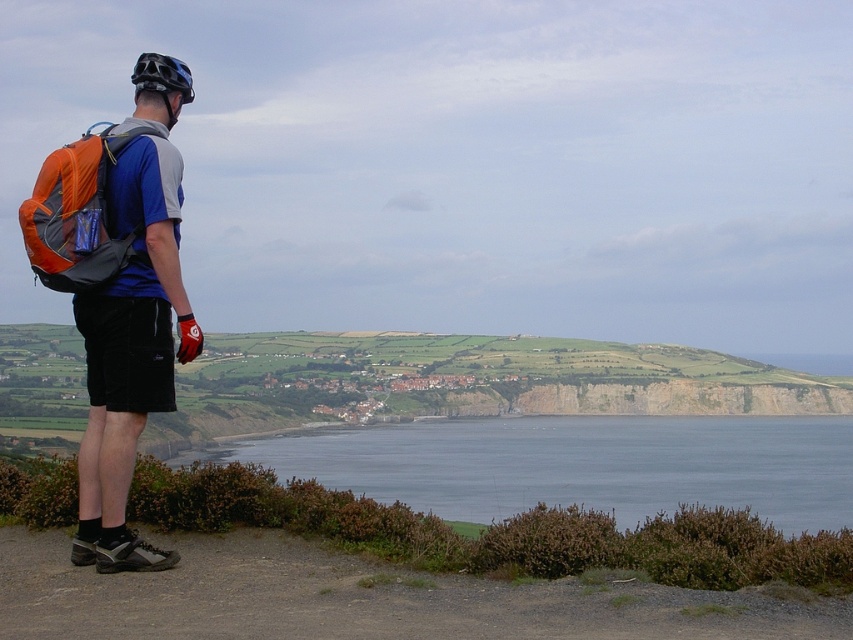
You are a hiker who wants to take a photo of the blue water at lower center and the black matte helmet at upper left. Which object should you focus on first if you want both to be in sharp focus?

The blue water at lower center is taller than the black matte helmet at upper left, so you should focus on the blue water at lower center first to ensure both are in sharp focus.

You are a hiker who wants to take a photo of the blue water at lower center and the orange fabric backpack at left. Which object should you focus on first if you want to capture both in one frame without moving your camera? Explain why based on their sizes.

You should focus on the blue water at lower center first because it is larger in size compared to the orange fabric backpack at left, making it the more dominant subject in the frame.

You are a hiker who wants to reach the blue water at lower center. You see the orange fabric backpack at left on the path. Which direction should you walk relative to the backpack to get closer to the water?

The blue water at lower center is further to the viewer than the orange fabric backpack at left, so to reach the blue water at lower center, you should walk away from the orange fabric backpack at left.